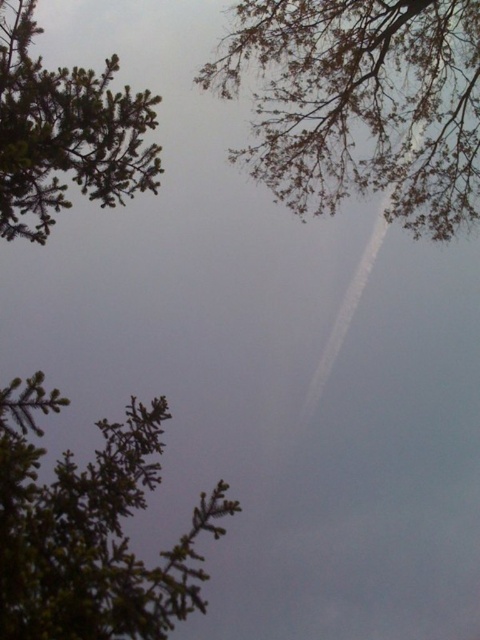
Measure the distance between brown textured branches at upper center and green matte tree at lower left.

They are 22.12 feet apart.

Between brown textured branches at upper center and green matte tree at lower left, which one appears on the right side from the viewer's perspective?

brown textured branches at upper center

Which is behind, point (393, 109) or point (19, 445)?

Point (393, 109)

Identify the location of brown textured branches at upper center. Image resolution: width=480 pixels, height=640 pixels. (361, 104).

Is green matte tree at lower left positioned in front of green matte tree at upper left?

Yes, green matte tree at lower left is in front of green matte tree at upper left.

Between green matte tree at lower left and green matte tree at upper left, which one has more height?

With more height is green matte tree at upper left.

Is point (191, 609) behind point (20, 68)?

No, it is not.

Find the location of `green matte tree at lower left`. green matte tree at lower left is located at coordinates (90, 529).

Is brown textured branches at upper center thinner than green matte tree at upper left?

No, brown textured branches at upper center is not thinner than green matte tree at upper left.

Who is shorter, brown textured branches at upper center or green matte tree at upper left?

With less height is green matte tree at upper left.

Is point (228, 56) positioned in front of point (7, 150)?

No, it is not.

Where is `brown textured branches at upper center`? The width and height of the screenshot is (480, 640). brown textured branches at upper center is located at coordinates (361, 104).